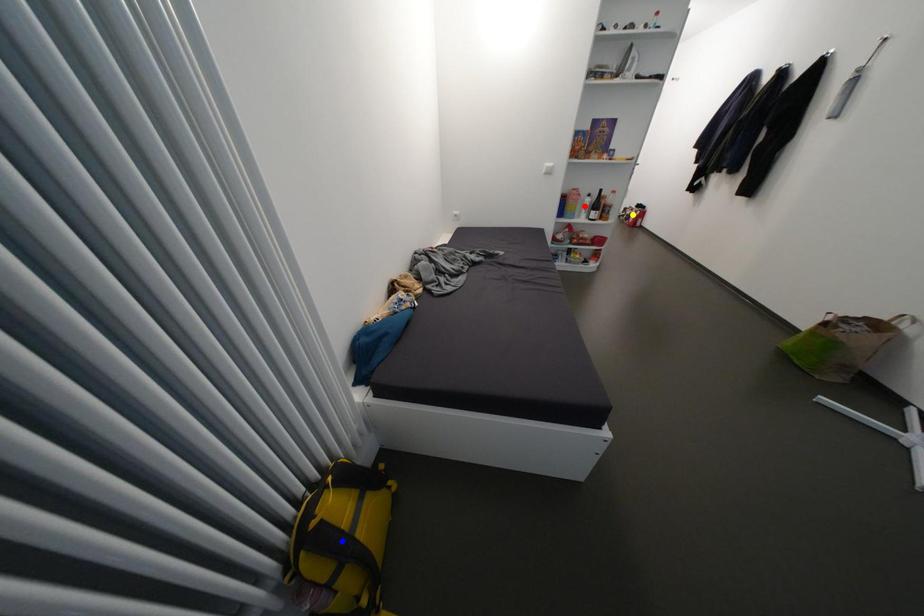
Consider the image. Order these from nearest to farthest:
A) blue point
B) red point
C) yellow point

blue point < red point < yellow point